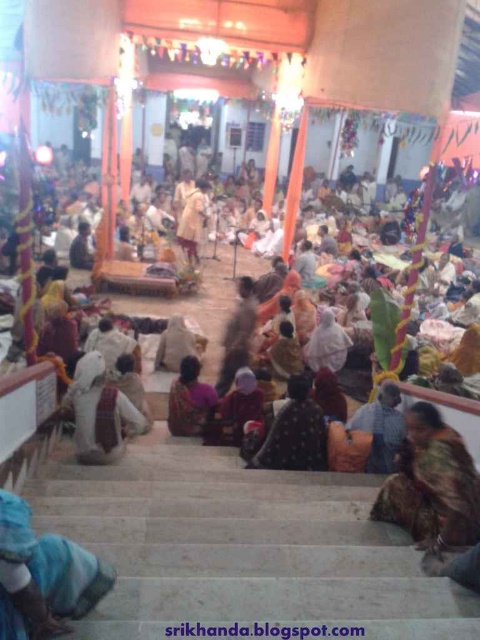
You are a visitor standing at the entrance of the temple. You want to approach the white clothed person at center to ask a question but need to pass by the blue fabric at lower left. Is there enough space for you to walk between them comfortably?

The distance between the blue fabric at lower left and the white clothed person at center is 2.78 meters. Since the average comfortable walking space for a person is about 0.7 to 1 meter, there is ample space to walk between them comfortably.

You are standing at the entrance of the temple and notice the multicolored fabric at lower right. Can you determine its exact position relative to the entrance using coordinates?

The multicolored fabric at lower right is located at point (432, 483), which means it is positioned towards the lower right corner of the scene from the entrance.